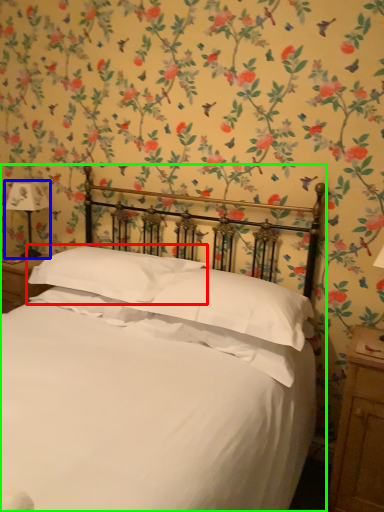
Question: Based on their relative distances, which object is farther from pillow (highlighted by a red box)? Choose from bedside lamp (highlighted by a blue box) and bed (highlighted by a green box).

Choices:
 (A) bedside lamp
 (B) bed

Answer: (A)